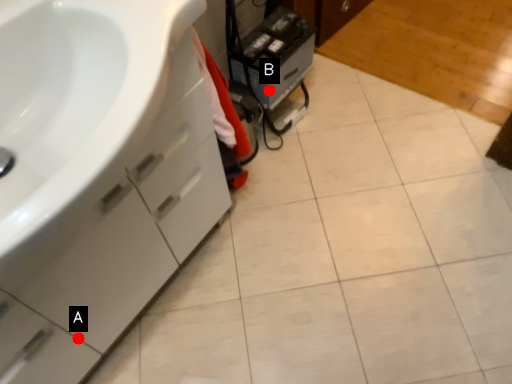
Question: Two points are circled on the image, labeled by A and B beside each circle. Which point is closer to the camera taking this photo?

Choices:
 (A) A is closer
 (B) B is closer

Answer: (A)